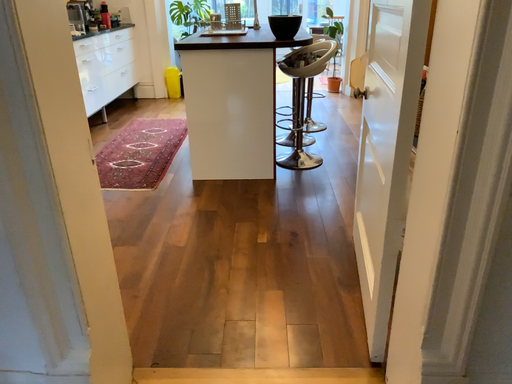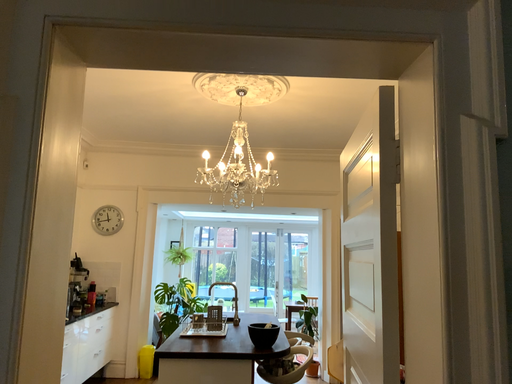
Question: Which way did the camera rotate in the video?

Choices:
 (A) rotated downward
 (B) rotated upward

Answer: (B)